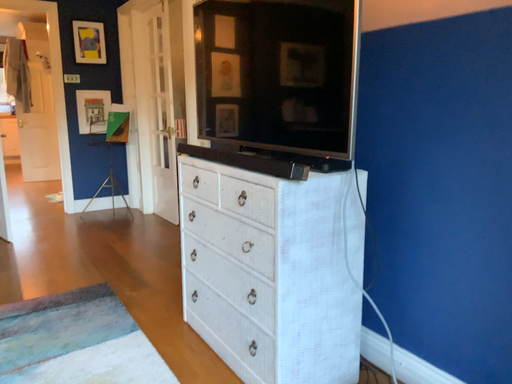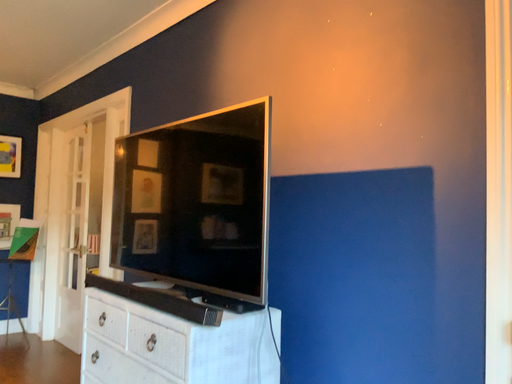
Question: Which way did the camera rotate in the video?

Choices:
 (A) rotated right
 (B) rotated left

Answer: (A)